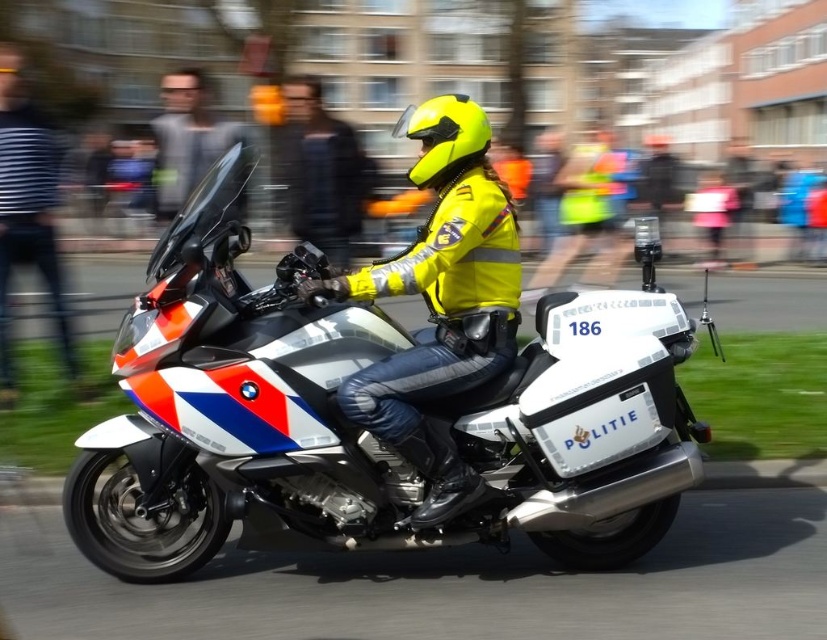
Question: Which point is farther from the camera taking this photo?

Choices:
 (A) (74, 490)
 (B) (319, 177)

Answer: (B)

Question: Where is high-visibility yellow jacket at center located in relation to yellow reflective jacket at center in the image?

Choices:
 (A) right
 (B) left

Answer: (A)

Question: Which of these objects is positioned closest to the high-visibility yellow jacket at center?

Choices:
 (A) white-police motorcycle at center
 (B) striped fabric shirt at left
 (C) yellow reflective jacket at center
 (D) yellow matte helmet at center

Answer: (A)

Question: Can you confirm if striped fabric shirt at left is smaller than yellow reflective jacket at center?

Choices:
 (A) no
 (B) yes

Answer: (B)

Question: Among these points, which one is nearest to the camera?

Choices:
 (A) (481, 128)
 (B) (271, 284)
 (C) (37, 250)

Answer: (A)

Question: From the image, what is the correct spatial relationship of high-visibility yellow jacket at center in relation to yellow reflective jacket at center?

Choices:
 (A) right
 (B) left

Answer: (A)